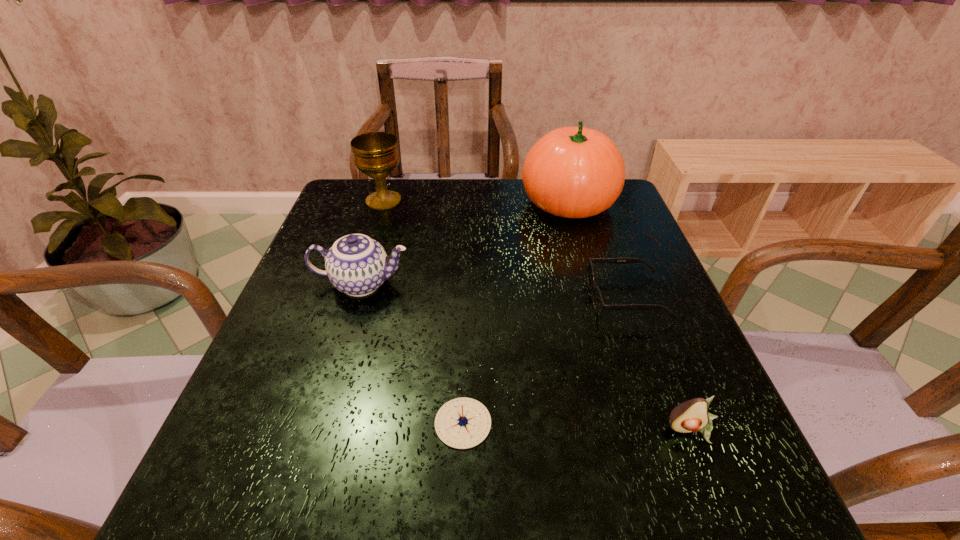
Identify the location of sunglasses that is positioned at the right edge. This screenshot has width=960, height=540. (598, 302).

The height and width of the screenshot is (540, 960). In order to click on object situated at the far left corner in this screenshot , I will do `click(376, 154)`.

At what (x,y) coordinates should I click in order to perform the action: click on object positioned at the far right corner. Please return your answer as a coordinate pair (x, y). Looking at the image, I should click on (574, 172).

The image size is (960, 540). What are the coordinates of `vacant space at the far edge of the desktop` in the screenshot? It's located at (412, 204).

I want to click on free spot at the left edge of the desktop, so click(x=358, y=303).

Find the location of a particular element. vacant space at the right edge is located at coordinates (674, 323).

In the image, there is a desktop. Where is `vacant space at the near left corner`? This screenshot has height=540, width=960. vacant space at the near left corner is located at coordinates (252, 496).

Locate an element on the screen. free point between the sunglasses and the chinaware is located at coordinates (494, 291).

Locate an element on the screen. This screenshot has height=540, width=960. free space between the fourth tallest object and the fifth shortest object is located at coordinates (538, 315).

Where is `free point between the pumpkin and the compass`? Image resolution: width=960 pixels, height=540 pixels. free point between the pumpkin and the compass is located at coordinates (516, 313).